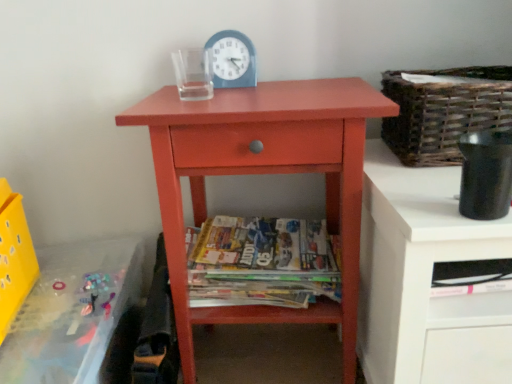
Question: From a real-world perspective, is woven brown basket at upper right located beneath printed paper magazines at center?

Choices:
 (A) no
 (B) yes

Answer: (A)

Question: From the image's perspective, is woven brown basket at upper right above printed paper magazines at center?

Choices:
 (A) yes
 (B) no

Answer: (A)

Question: Can you confirm if woven brown basket at upper right is taller than printed paper magazines at center?

Choices:
 (A) no
 (B) yes

Answer: (B)

Question: Is woven brown basket at upper right beside printed paper magazines at center?

Choices:
 (A) yes
 (B) no

Answer: (B)

Question: From a real-world perspective, does woven brown basket at upper right stand above printed paper magazines at center?

Choices:
 (A) yes
 (B) no

Answer: (A)

Question: Is printed paper magazines at center in front of or behind woven brown basket at upper right in the image?

Choices:
 (A) front
 (B) behind

Answer: (B)

Question: Is point (302, 256) positioned closer to the camera than point (480, 119)?

Choices:
 (A) farther
 (B) closer

Answer: (A)

Question: In terms of size, does printed paper magazines at center appear bigger or smaller than woven brown basket at upper right?

Choices:
 (A) small
 (B) big

Answer: (A)

Question: Looking at their shapes, would you say printed paper magazines at center is wider or thinner than woven brown basket at upper right?

Choices:
 (A) wide
 (B) thin

Answer: (A)

Question: Is blue plastic clock at upper center taller or shorter than yellow plastic crate at lower left?

Choices:
 (A) short
 (B) tall

Answer: (A)

Question: From the image's perspective, relative to yellow plastic crate at lower left, is blue plastic clock at upper center above or below?

Choices:
 (A) above
 (B) below

Answer: (A)

Question: Is blue plastic clock at upper center inside the boundaries of yellow plastic crate at lower left, or outside?

Choices:
 (A) outside
 (B) inside

Answer: (A)

Question: Is point (234, 46) positioned closer to the camera than point (6, 256)?

Choices:
 (A) closer
 (B) farther

Answer: (B)

Question: Considering their positions, is translucent plastic changing table at lower left located in front of or behind blue plastic clock at upper center?

Choices:
 (A) front
 (B) behind

Answer: (A)

Question: Based on their positions, is translucent plastic changing table at lower left located to the left or right of blue plastic clock at upper center?

Choices:
 (A) right
 (B) left

Answer: (B)